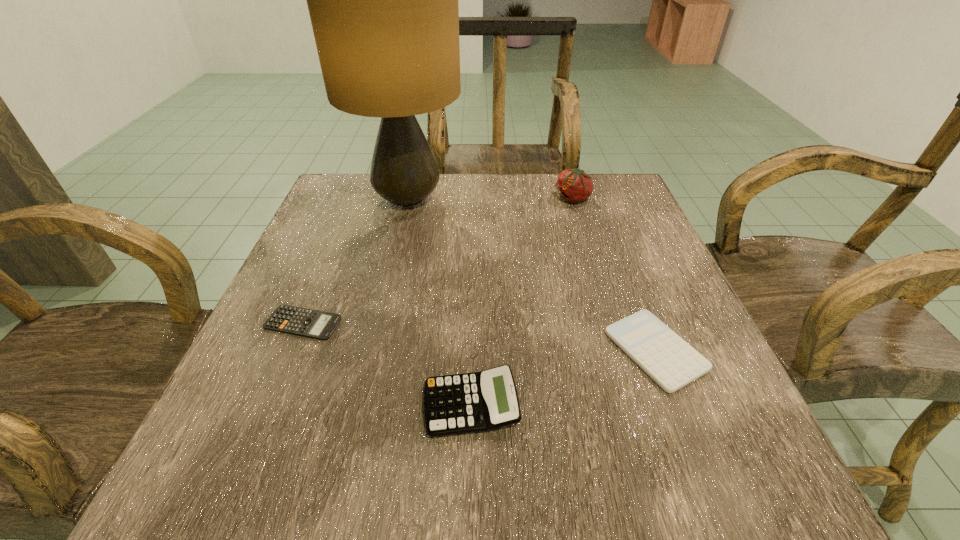
Locate an element on the screen. This screenshot has height=540, width=960. free point located 0.290m on the back of the third shortest object is located at coordinates (473, 258).

Locate an element on the screen. vacant space situated on the back of the second shortest calculator is located at coordinates (621, 260).

Locate an element on the screen. The image size is (960, 540). free spot located 0.090m on the front of the shortest calculator is located at coordinates (277, 387).

The height and width of the screenshot is (540, 960). Identify the location of lampshade present at the far edge. click(383, 0).

Image resolution: width=960 pixels, height=540 pixels. Find the location of `tomato that is at the far edge`. tomato that is at the far edge is located at coordinates (574, 185).

Where is `object present at the near edge`? object present at the near edge is located at coordinates (481, 401).

This screenshot has height=540, width=960. Identify the location of lampshade that is positioned at the left edge. (383, 0).

Find the location of a particular element. calculator that is at the left edge is located at coordinates (294, 320).

You are a GUI agent. You are given a task and a screenshot of the screen. Output one action in this format:
    pyautogui.click(x=<x>, y=<y>)
    Task: Click on the tomato that is at the right edge
    
    Given the screenshot: What is the action you would take?
    pyautogui.click(x=574, y=185)

Where is `calculator that is at the right edge`? calculator that is at the right edge is located at coordinates (665, 357).